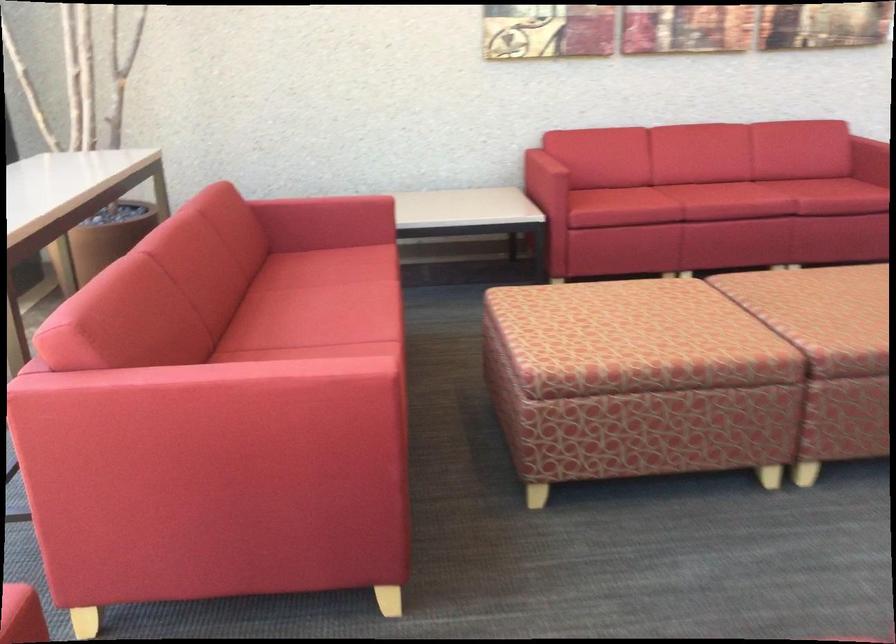
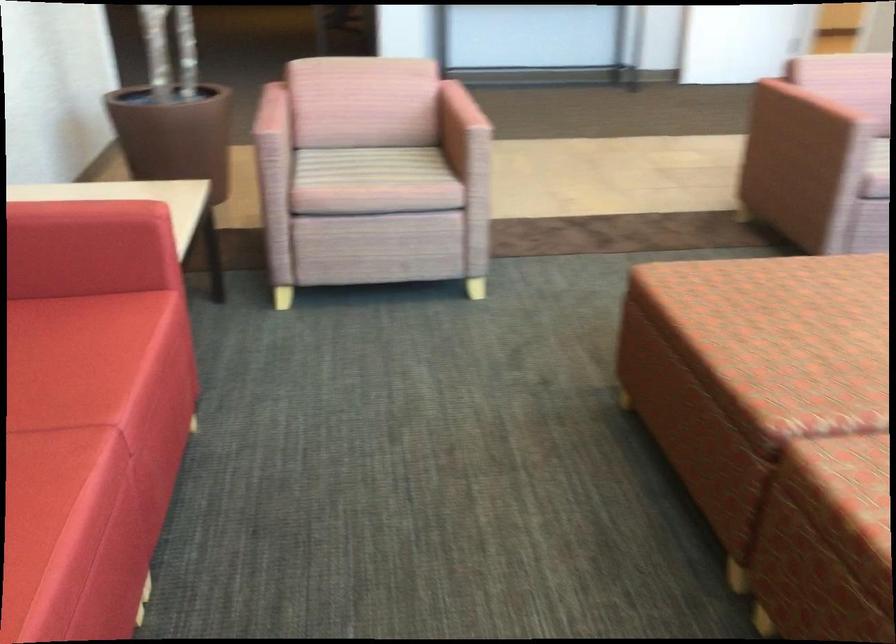
Locate, in the second image, the point that corresponds to point (820, 182) in the first image.

(69, 360)